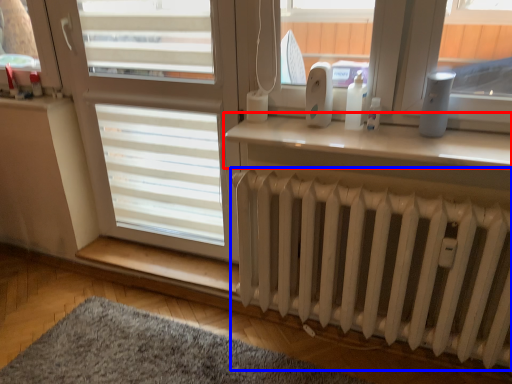
Question: Which object is closer to the camera taking this photo, window (highlighted by a red box) or radiator (highlighted by a blue box)?

Choices:
 (A) window
 (B) radiator

Answer: (B)